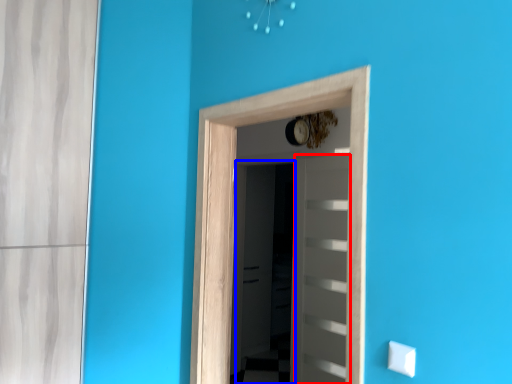
Question: Which object is further to the camera taking this photo, door (highlighted by a red box) or screen door (highlighted by a blue box)?

Choices:
 (A) door
 (B) screen door

Answer: (B)